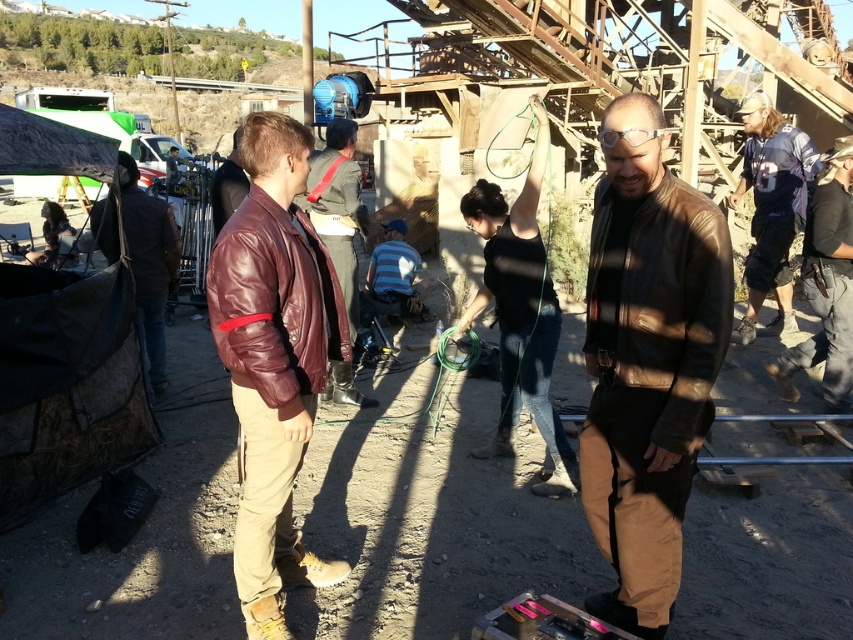
You are a film crew member trying to locate the actor wearing the burgundy leather jacket at center. According to the coordinates provided, where exactly should you look to find this actor?

The actor wearing the burgundy leather jacket at center is located at coordinates point (273,358).

You are a camera operator trying to set up a wide shot of the two people in the scene. The minimum distance required between the camera and the subjects for a clear wide shot is 5 meters. Given the distance between the burgundy leather jacket at center and the blue jersey at right, do you think you can achieve this shot without moving the subjects?

The burgundy leather jacket at center and blue jersey at right are 4.52 meters apart, which is less than the required 5 meters. Therefore, the camera operator cannot achieve a clear wide shot without moving the subjects closer together or adjusting the camera settings to accommodate the shorter distance.